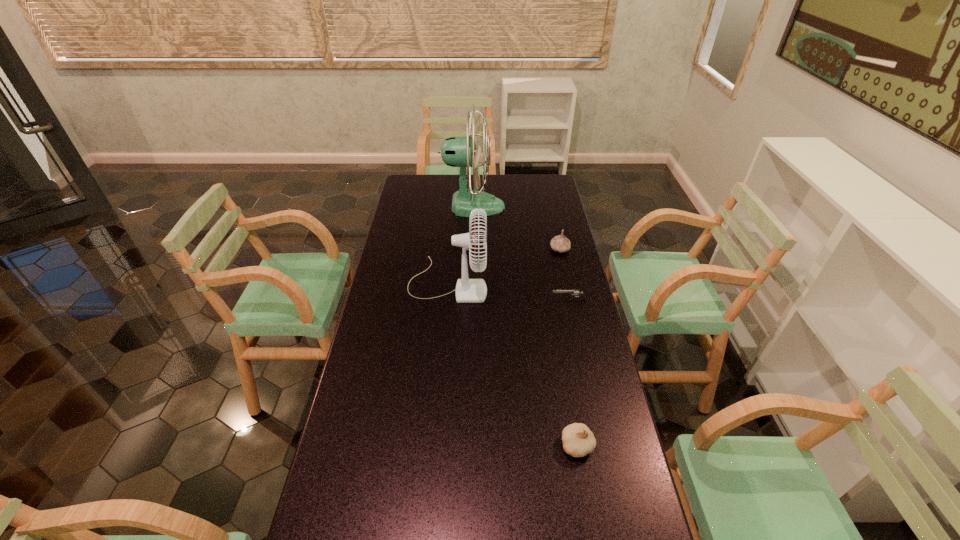
I want to click on the tallest object, so click(x=455, y=151).

Where is `the taller fan`? the taller fan is located at coordinates (455, 151).

Find the location of a particular element. This screenshot has width=960, height=540. the nearer fan is located at coordinates (467, 290).

You are a GUI agent. You are given a task and a screenshot of the screen. Output one action in this format:
    pyautogui.click(x=<x>, y=<y>)
    Task: Click on the shorter fan
    This screenshot has width=960, height=540.
    Given the screenshot: What is the action you would take?
    pyautogui.click(x=467, y=290)

Find the location of a particular element. The width and height of the screenshot is (960, 540). the second farthest object is located at coordinates (560, 243).

Where is `the shorter garlic`? the shorter garlic is located at coordinates (578, 440).

The image size is (960, 540). I want to click on the fourth tallest object, so click(x=578, y=440).

Where is `the shortest object`? the shortest object is located at coordinates (573, 292).

Find the location of a particular element. blank area located 0.220m in front of the farthest object, directing airflow is located at coordinates (551, 206).

Where is `vacant point located 0.180m on the front-facing side of the nearer fan`? Image resolution: width=960 pixels, height=540 pixels. vacant point located 0.180m on the front-facing side of the nearer fan is located at coordinates (535, 282).